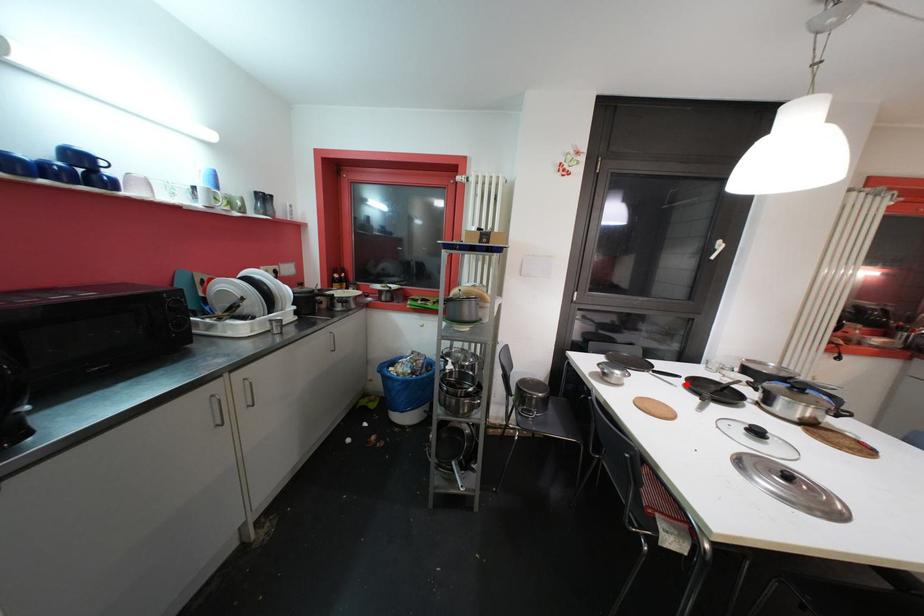
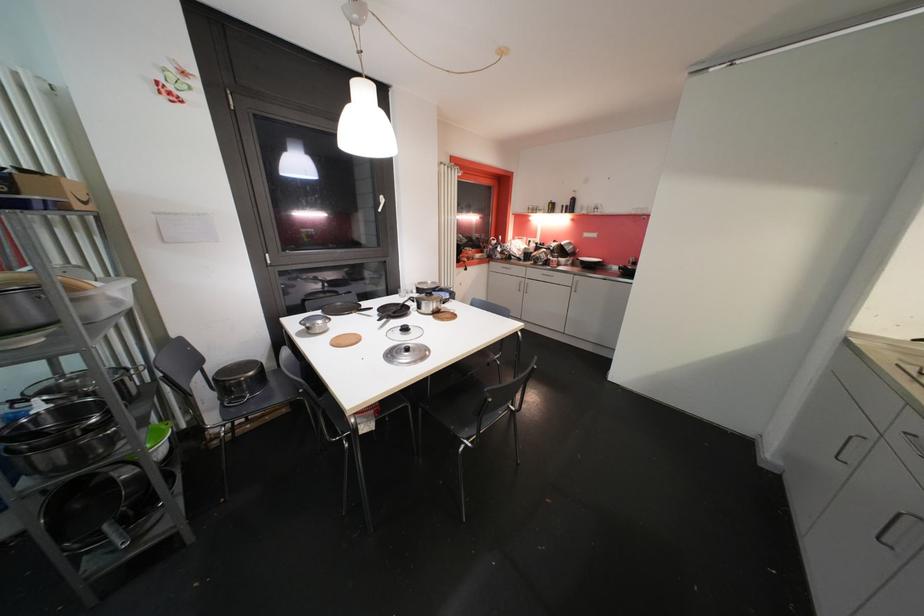
Locate, in the second image, the point that corresponds to the highlighted location in the first image.

(379, 315)